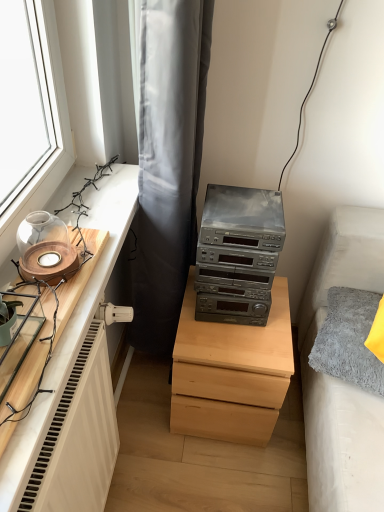
Find the location of a particular element. This screenshot has height=512, width=384. free space above wooden tray at left (from a real-world perspective) is located at coordinates (39, 290).